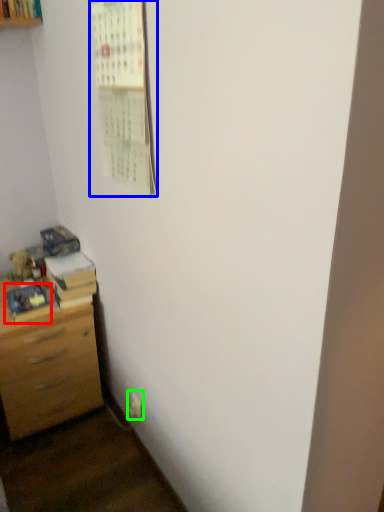
Question: Estimate the real-world distances between objects in this image. Which object is closer to book (highlighted by a red box), bulletin board (highlighted by a blue box) or electric outlet (highlighted by a green box)?

Choices:
 (A) bulletin board
 (B) electric outlet

Answer: (B)